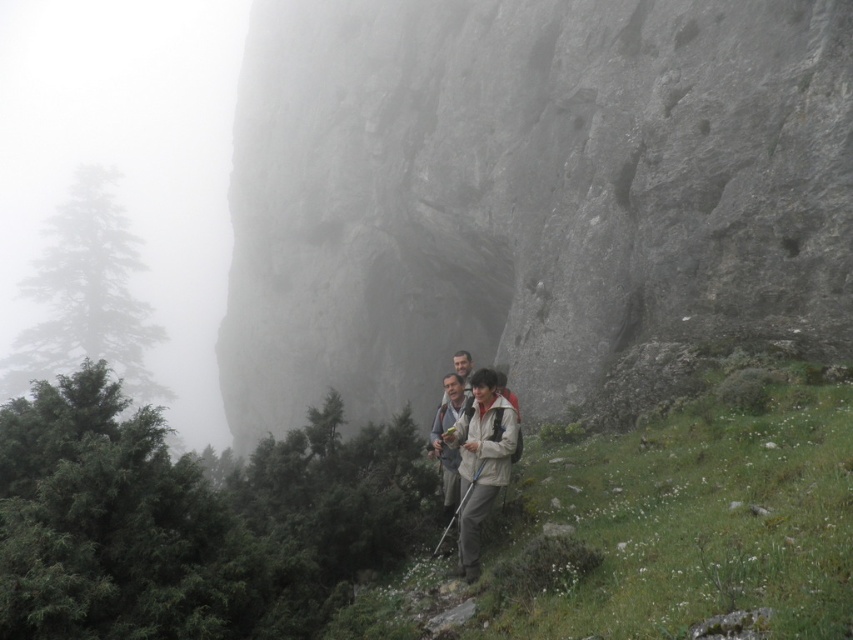
You are a hiker standing at the grassy slope with small white flowers. You want to reach the rugged stone mountain at center. Which direction should you move to get closer to it?

The rugged stone mountain at center is located at point (x=525, y=192), so you should move towards the center of the scene to approach it.

You are a hiker standing at the point with coordinates point (525, 192). Looking around, you see rugged stone mountain at center. Which direction should you head to reach the rugged stone mountain at center?

The point (525, 192) corresponds to rugged stone mountain at center, so you are already at the rugged stone mountain at center.

You are a hiker who wants to take a photo of the rugged stone mountain at center and the beige fabric jacket at center. Which object should you focus on first to ensure it appears larger in your photo?

The rugged stone mountain at center is much taller than the beige fabric jacket at center, so focusing on it first will ensure it appears larger in your photo.